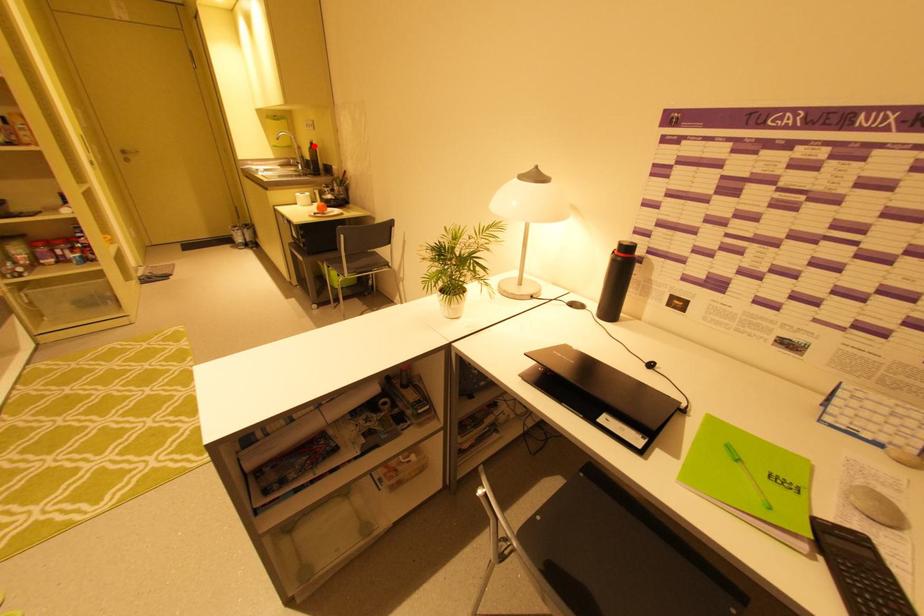
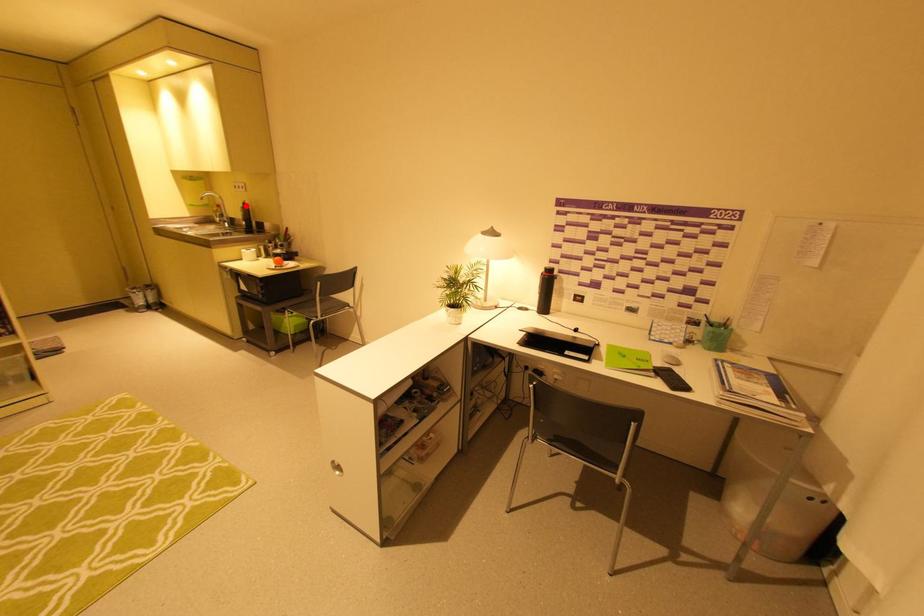
I am providing you with two images of the same scene from different viewpoints. A red point is marked on the first image and another point is marked on the second image. Does the point marked in image1 correspond to the same location as the one in image2?

Yes